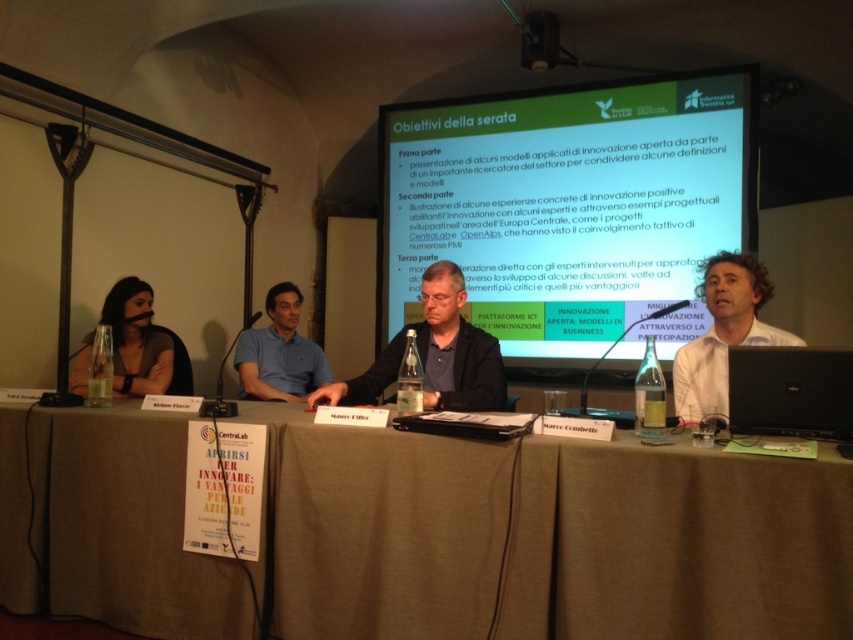
Question: Can you confirm if green matte projector screen at upper center is positioned below matte blue polo shirt at center?

Choices:
 (A) yes
 (B) no

Answer: (B)

Question: Does black matte laptop at lower right have a lesser width compared to matte blue polo shirt at center?

Choices:
 (A) yes
 (B) no

Answer: (A)

Question: Among these objects, which one is nearest to the camera?

Choices:
 (A) matte black shirt at center
 (B) matte blue polo shirt at center
 (C) black matte laptop at lower right

Answer: (C)

Question: Which is farther from the brown fabric table at lower center?

Choices:
 (A) matte black laptop at right
 (B) matte blue polo shirt at center
 (C) black matte laptop at lower right
 (D) green matte projector screen at upper center

Answer: (D)

Question: Which point appears closest to the camera in this image?

Choices:
 (A) (737, 349)
 (B) (705, 211)

Answer: (A)

Question: Does green matte projector screen at upper center appear on the left side of black matte laptop at lower right?

Choices:
 (A) no
 (B) yes

Answer: (B)